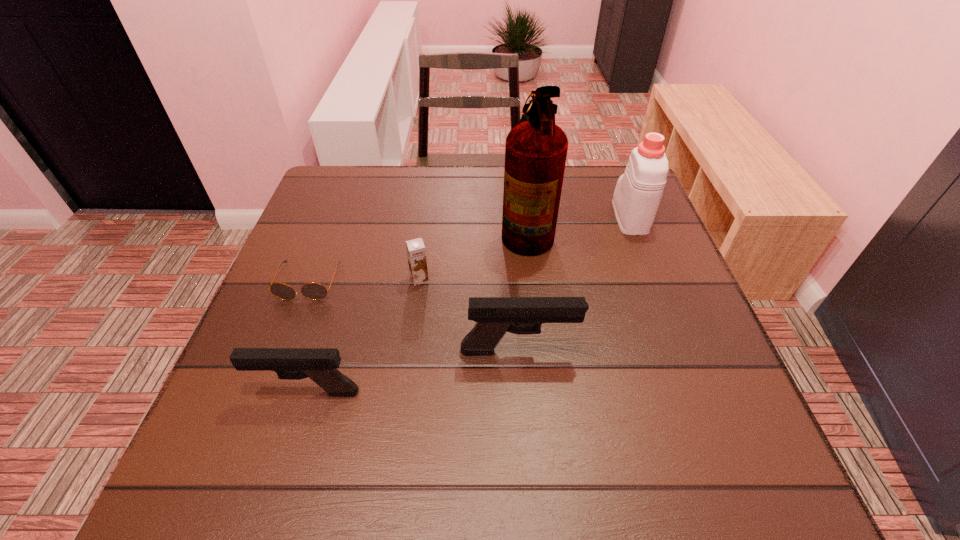
Point out which object is positioned as the nearest to the fourth object from right to left. Please provide its 2D coordinates. Your answer should be formatted as a tuple, i.e. [(x, y)], where the tuple contains the x and y coordinates of a point satisfying the conditions above.

[(314, 291)]

I want to click on vacant point that satisfies the following two spatial constraints: 1. at the nozzle of the fire extinguisher; 2. on the front side of the chocolate milk, so click(x=532, y=279).